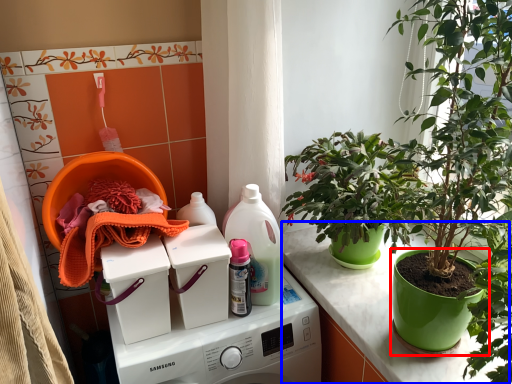
Question: Among these objects, which one is farthest to the camera, flowerpot (highlighted by a red box) or counter (highlighted by a blue box)?

Choices:
 (A) flowerpot
 (B) counter

Answer: (B)